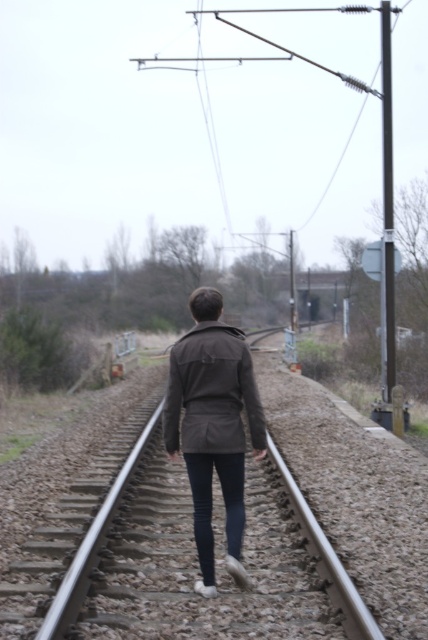
You are standing on the railway track and see the dark brown jacket at center and the smooth metal train track at center. Which object is closer to you?

The dark brown jacket at center is closer to you because it is further to the viewer than the smooth metal train track at center.

You are a photographer trying to capture a shot of the person walking along the railway track. You notice two jackets on the person. Which jacket, the dark brown jacket at center or the dark brown matte jacket at center, is positioned to the right?

The dark brown jacket at center is positioned to the right of the dark brown matte jacket at center.

You are a photographer trying to capture a shot of the dark brown jacket at center and the smooth metal train track at center. Which object appears smaller in the photo?

The dark brown jacket at center appears smaller in the photo compared to the smooth metal train track at center because it has a smaller size.